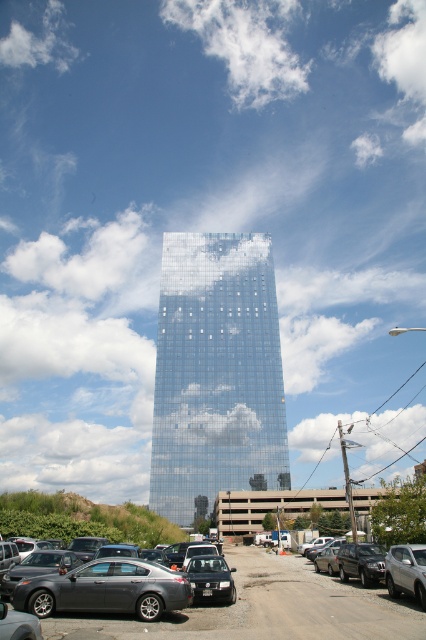
You are standing in the parking lot and looking at the gray matte car at lower left and the white fluffy cloud at upper left. Which object is positioned higher in the image?

The white fluffy cloud at upper left is positioned higher than the gray matte car at lower left.

You are a delivery driver who needs to park your vehicle in the parking lot. You see the gray matte car at lower left and the satin silver sedan at lower right. Which vehicle should you choose to park next to if you want to park next to a larger vehicle?

You should park next to the gray matte car at lower left because it is bigger than the satin silver sedan at lower right.

You are a delivery driver who needs to park your vehicle between the gray matte car at lower left and the satin silver sedan at lower right. Is there enough space between them to fit your 2.5 meter long van?

The distance between the gray matte car at lower left and the satin silver sedan at lower right is 3 meters, so yes, your 2.5 meter long van can fit between them.